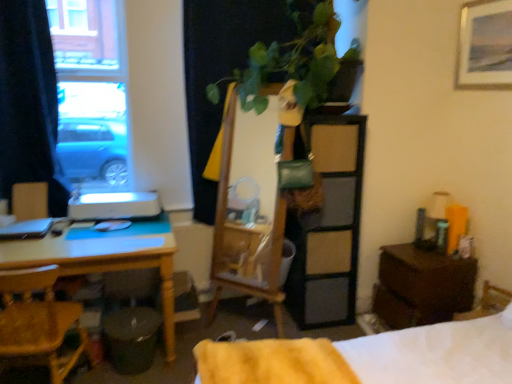
What is the approximate height of black fabric curtain at left?

black fabric curtain at left is 4.59 feet tall.

The width and height of the screenshot is (512, 384). What do you see at coordinates (92, 91) in the screenshot?
I see `blue glass window at upper left` at bounding box center [92, 91].

This screenshot has height=384, width=512. Describe the element at coordinates (39, 322) in the screenshot. I see `yellow wood chair at lower left` at that location.

You are a GUI agent. You are given a task and a screenshot of the screen. Output one action in this format:
    pyautogui.click(x=<x>, y=<y>)
    Task: Click on the yellow fluffy blanket at lower center
    
    Given the screenshot: What is the action you would take?
    pyautogui.click(x=271, y=362)

From a real-world perspective, does wooden framed painting at upper right sit lower than yellow wood desk at left?

Incorrect, from a real-world perspective, wooden framed painting at upper right is higher than yellow wood desk at left.

Can yellow wood desk at left be found inside wooden framed painting at upper right?

Definitely not — yellow wood desk at left is not inside wooden framed painting at upper right.

Can you see wooden framed painting at upper right touching yellow wood desk at left?

No, wooden framed painting at upper right is not next to yellow wood desk at left.

Does wooden framed painting at upper right appear on the right side of yellow wood desk at left?

Yes, wooden framed painting at upper right is to the right of yellow wood desk at left.

From the image's perspective, which one is positioned lower, wooden framed painting at upper right or brown matte nightstand at lower right?

brown matte nightstand at lower right appears lower in the image.

Is wooden framed painting at upper right turned away from brown matte nightstand at lower right?

No, brown matte nightstand at lower right is not at the back of wooden framed painting at upper right.

Is wooden framed painting at upper right at the right side of brown matte nightstand at lower right?

Yes, wooden framed painting at upper right is to the right of brown matte nightstand at lower right.

From a real-world perspective, which is physically above, yellow wood chair at lower left or green leafy plant at upper center?

green leafy plant at upper center.

From the picture: Does yellow wood chair at lower left contain green leafy plant at upper center?

No, green leafy plant at upper center is not inside yellow wood chair at lower left.

Is yellow wood chair at lower left in front of or behind green leafy plant at upper center in the image?

In the image, yellow wood chair at lower left appears in front of green leafy plant at upper center.

Considering the relative sizes of yellow wood chair at lower left and green leafy plant at upper center in the image provided, is yellow wood chair at lower left shorter than green leafy plant at upper center?

In fact, yellow wood chair at lower left may be taller than green leafy plant at upper center.

Would you say wooden mirror at center, which is the first dresser in left-to-right order, is to the left or to the right of wooden framed painting at upper right in the picture?

Clearly, wooden mirror at center, which is the first dresser in left-to-right order, is on the left of wooden framed painting at upper right in the image.

Considering the sizes of objects wooden mirror at center, which is the first dresser in left-to-right order, and wooden framed painting at upper right in the image provided, who is bigger, wooden mirror at center, which is the first dresser in left-to-right order, or wooden framed painting at upper right?

Bigger between the two is wooden mirror at center, which is the first dresser in left-to-right order.

Is wooden mirror at center, which is the second dresser in right-to-left order, closer to the viewer compared to wooden framed painting at upper right?

Yes, wooden mirror at center, which is the second dresser in right-to-left order, is closer to the camera.

From the image's perspective, is wooden mirror at center, which is the first dresser in left-to-right order, located beneath wooden framed painting at upper right?

Yes, from the image's perspective, wooden mirror at center, which is the first dresser in left-to-right order, is below wooden framed painting at upper right.

Is wooden mirror at center, which is the first dresser in left-to-right order, a part of white soft bed at lower right?

No, wooden mirror at center, which is the first dresser in left-to-right order, is not surrounded by white soft bed at lower right.

Is white soft bed at lower right turned away from wooden mirror at center, which is the second dresser in right-to-left order?

white soft bed at lower right is not turned away from wooden mirror at center, which is the second dresser in right-to-left order.

Is white soft bed at lower right positioned far away from wooden mirror at center, which is the first dresser in left-to-right order?

Yes, white soft bed at lower right is far from wooden mirror at center, which is the first dresser in left-to-right order.

Can you confirm if white soft bed at lower right is positioned to the left of wooden mirror at center, which is the second dresser in right-to-left order?

In fact, white soft bed at lower right is to the right of wooden mirror at center, which is the second dresser in right-to-left order.

In the scene shown: Considering the relative sizes of wooden framed painting at upper right and yellow wood chair at lower left in the image provided, is wooden framed painting at upper right shorter than yellow wood chair at lower left?

Yes.

Does point (458, 53) come behind point (46, 340)?

Yes, point (458, 53) is farther from viewer.

Which of these two, wooden framed painting at upper right or yellow wood chair at lower left, is smaller?

wooden framed painting at upper right is smaller.

How different are the orientations of wooden framed painting at upper right and yellow wood chair at lower left in degrees?

101 degrees.

Are wooden mirror at center, which is the second dresser in right-to-left order, and yellow wood chair at lower left making contact?

They are not placed beside each other.

Is wooden mirror at center, which is the second dresser in right-to-left order, facing towards yellow wood chair at lower left?

No, wooden mirror at center, which is the second dresser in right-to-left order, is not facing towards yellow wood chair at lower left.

Considering the sizes of objects wooden mirror at center, which is the second dresser in right-to-left order, and yellow wood chair at lower left in the image provided, who is bigger, wooden mirror at center, which is the second dresser in right-to-left order, or yellow wood chair at lower left?

Bigger between the two is wooden mirror at center, which is the second dresser in right-to-left order.

Considering the sizes of objects wooden mirror at center, which is the first dresser in left-to-right order, and yellow wood chair at lower left in the image provided, who is shorter, wooden mirror at center, which is the first dresser in left-to-right order, or yellow wood chair at lower left?

yellow wood chair at lower left is shorter.

Identify the location of desk below the wooden framed painting at upper right (from a real-world perspective). Image resolution: width=512 pixels, height=384 pixels. (105, 258).

Identify the location of picture frame on the right of brown matte nightstand at lower right. Image resolution: width=512 pixels, height=384 pixels. (485, 44).

Which object lies further to the anchor point brown matte nightstand at lower right, green leafy plant at upper center or yellow fluffy blanket at lower center?

The object further to brown matte nightstand at lower right is green leafy plant at upper center.

Considering their positions, is black fabric curtain at left positioned closer to blue glass window at upper left than yellow wood desk at left?

Based on the image, black fabric curtain at left appears to be nearer to blue glass window at upper left.

Based on their spatial positions, is matte wood armchair at left or yellow wood chair at lower left closer to green leafy plant at upper center?

yellow wood chair at lower left is closer to green leafy plant at upper center.

Looking at the image, which one is located further to matte beige cabinet at center right, the 1th dresser in the right-to-left sequence, wooden mirror at center, which is the second dresser in right-to-left order, or green leafy plant at upper center?

The object further to matte beige cabinet at center right, the 1th dresser in the right-to-left sequence, is green leafy plant at upper center.

From the image, which object appears to be nearer to wooden mirror at center, which is the second dresser in right-to-left order, yellow wood chair at lower left or wooden framed painting at upper right?

The object closer to wooden mirror at center, which is the second dresser in right-to-left order, is wooden framed painting at upper right.

From the image, which object appears to be farther from yellow wood desk at left, matte wood armchair at left or wooden framed painting at upper right?

wooden framed painting at upper right.

Looking at the image, which one is located closer to yellow fluffy blanket at lower center, matte wood armchair at left or brown matte nightstand at lower right?

Based on the image, brown matte nightstand at lower right appears to be nearer to yellow fluffy blanket at lower center.

Estimate the real-world distances between objects in this image. Which object is further from yellow fluffy blanket at lower center, matte beige cabinet at center right, arranged as the second dresser when viewed from the left, or wooden framed painting at upper right?

Result: wooden framed painting at upper right.

I want to click on houseplant between wooden framed painting at upper right and yellow fluffy blanket at lower center in the vertical direction, so click(x=297, y=62).

Image resolution: width=512 pixels, height=384 pixels. Find the location of `dresser between white soft bed at lower right and matte beige cabinet at center right, arranged as the second dresser when viewed from the left, along the z-axis`. dresser between white soft bed at lower right and matte beige cabinet at center right, arranged as the second dresser when viewed from the left, along the z-axis is located at coordinates 294,217.

Where is `nightstand between black fabric curtain at left and wooden framed painting at upper right from left to right`? nightstand between black fabric curtain at left and wooden framed painting at upper right from left to right is located at coordinates (421, 286).

The width and height of the screenshot is (512, 384). I want to click on desk that lies between blue glass window at upper left and yellow fluffy blanket at lower center from top to bottom, so click(105, 258).